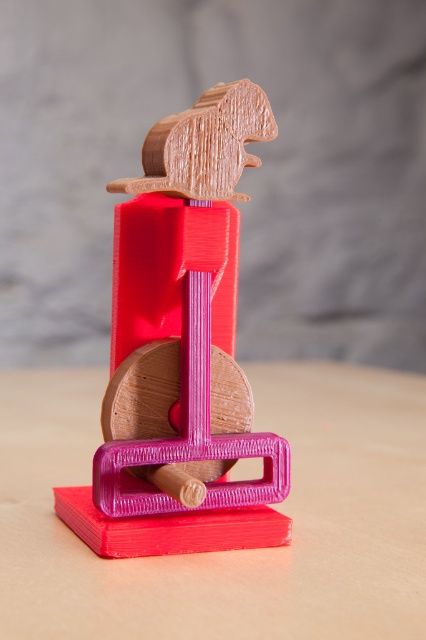
You are setting up a small desk area and have both the pink matte table at center and the matte wood mouse at center. Which item should you place under the other to ensure stability?

The pink matte table at center should be placed under the matte wood mouse at center because the table is shorter, making it a stable base.

From the picture: You are organizing a small party and have a pink matte table at center and a matte wood mouse at center on your desk. Which object can accommodate more snacks?

The pink matte table at center has a larger size compared to the matte wood mouse at center, so it can accommodate more snacks.

You are looking at the 3D printed object from the front. Which of the two points, point (405,611) or point (282,480), is closer to you?

Point (405,611) is in front of point (282,480), so it is closer to you.